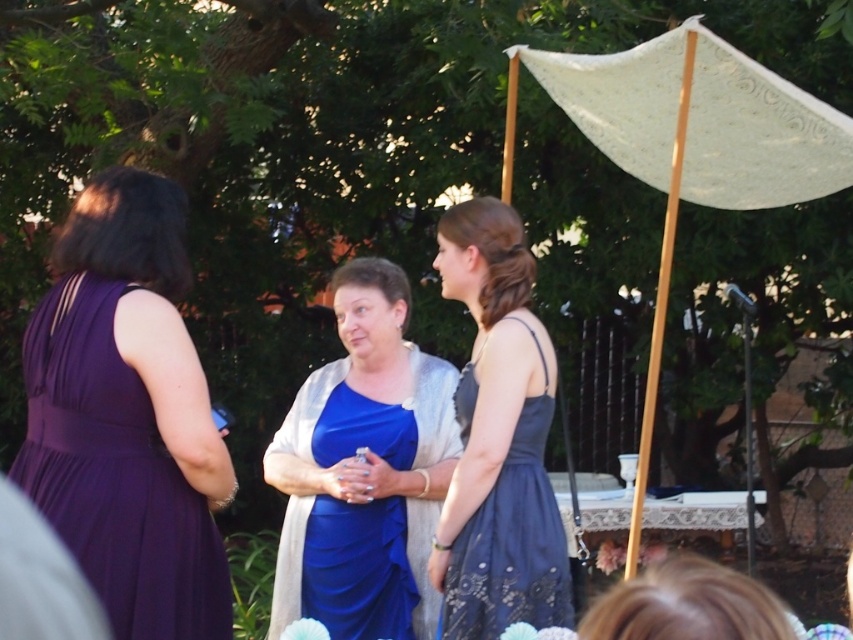
You are planning to take a photo of the purple satin dress at left and the white lace canopy at upper right in the scene. The camera you have can capture objects within a 10 feet range. Will both objects be in the same frame?

The purple satin dress at left and white lace canopy at upper right are 8.22 feet apart from each other, which is within the camera range of 10 feet. Therefore, both objects can be captured in the same frame.